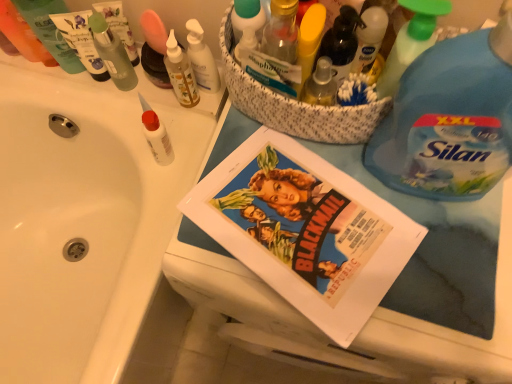
Question: Does matte green tube at upper left, the sixth toiletry positioned from the right, turn towards white matte glue at upper left, the fifth toiletry from the left?

Choices:
 (A) no
 (B) yes

Answer: (A)

Question: From a real-world perspective, is matte green tube at upper left, the sixth toiletry positioned from the right, positioned over white matte glue at upper left, placed as the 4th toiletry when sorted from right to left, based on gravity?

Choices:
 (A) no
 (B) yes

Answer: (B)

Question: Is matte green tube at upper left, which is the third toiletry in left-to-right order, bigger than white matte glue at upper left, placed as the 4th toiletry when sorted from right to left?

Choices:
 (A) no
 (B) yes

Answer: (B)

Question: Considering the relative sizes of matte green tube at upper left, which is the third toiletry in left-to-right order, and white matte glue at upper left, placed as the 4th toiletry when sorted from right to left, in the image provided, is matte green tube at upper left, which is the third toiletry in left-to-right order, thinner than white matte glue at upper left, placed as the 4th toiletry when sorted from right to left,?

Choices:
 (A) no
 (B) yes

Answer: (A)

Question: From the image's perspective, is matte green tube at upper left, which is the third toiletry in left-to-right order, above white matte glue at upper left, placed as the 4th toiletry when sorted from right to left?

Choices:
 (A) no
 (B) yes

Answer: (B)

Question: From the image's perspective, is matte green tube at upper left, which is the third toiletry in left-to-right order, beneath white matte glue at upper left, the fifth toiletry from the left?

Choices:
 (A) yes
 (B) no

Answer: (B)

Question: From the image's perspective, is white paper at upper center located beneath translucent plastic bottle at upper center?

Choices:
 (A) yes
 (B) no

Answer: (A)

Question: Is the depth of white paper at upper center less than that of translucent plastic bottle at upper center?

Choices:
 (A) no
 (B) yes

Answer: (B)

Question: Does white paper at upper center have a greater height compared to translucent plastic bottle at upper center?

Choices:
 (A) no
 (B) yes

Answer: (B)

Question: Does white paper at upper center touch translucent plastic bottle at upper center?

Choices:
 (A) yes
 (B) no

Answer: (B)

Question: Is white paper at upper center located outside translucent plastic bottle at upper center?

Choices:
 (A) yes
 (B) no

Answer: (A)

Question: From a real-world perspective, does white paper at upper center sit lower than translucent plastic bottle at upper center?

Choices:
 (A) yes
 (B) no

Answer: (A)

Question: Is translucent glass bottle at upper center, which is the eighth toiletry from left to right, shorter than green plastic spray bottle at upper right, marked as the 2th cleaning product in a right-to-left arrangement?

Choices:
 (A) yes
 (B) no

Answer: (A)